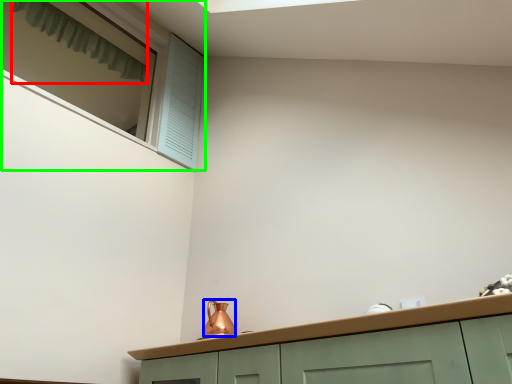
Question: Based on their relative distances, which object is nearer to curtain (highlighted by a red box)? Choose from tea pot (highlighted by a blue box) and window (highlighted by a green box).

Choices:
 (A) tea pot
 (B) window

Answer: (B)